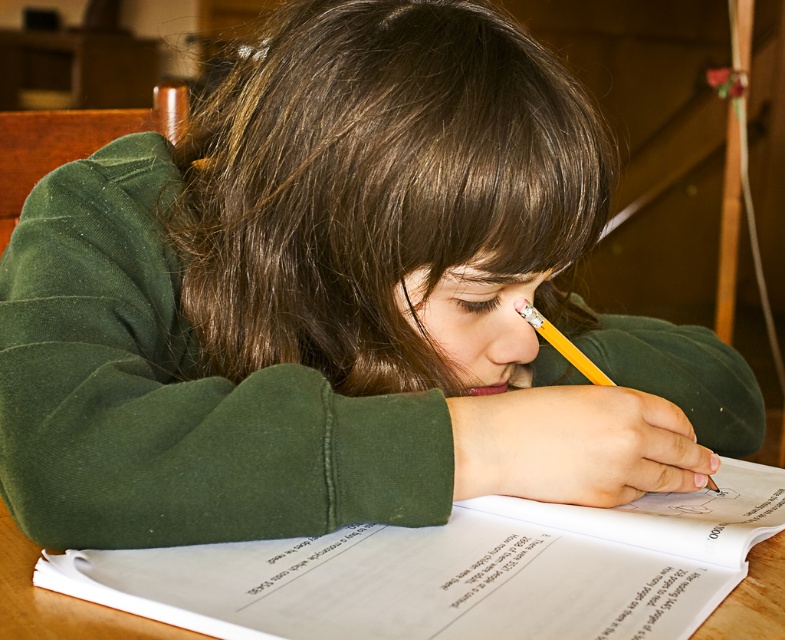
The width and height of the screenshot is (785, 640). What do you see at coordinates (455, 572) in the screenshot? I see `wooden table at center` at bounding box center [455, 572].

In the scene shown: Between wooden table at center and yellow wood pencil at upper center, which one has less height?

Standing shorter between the two is wooden table at center.

Identify the location of wooden table at center. (455, 572).

Can you confirm if wooden table at center is smaller than white paper at lower center?

No.

The width and height of the screenshot is (785, 640). Describe the element at coordinates (455, 572) in the screenshot. I see `wooden table at center` at that location.

Which is behind, point (586, 544) or point (506, 550)?

The point (586, 544) is behind.

Find the location of `wooden table at center`. wooden table at center is located at coordinates (455, 572).

Is the position of white paper at lower center more distant than that of yellow wood pencil at upper center?

No, white paper at lower center is closer to the viewer.

Does point (484, 564) lie behind point (548, 340)?

No, (484, 564) is in front of (548, 340).

Where is `white paper at lower center`? The width and height of the screenshot is (785, 640). white paper at lower center is located at coordinates (490, 566).